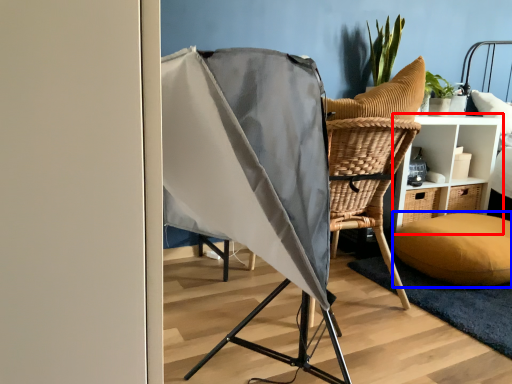
Question: Among these objects, which one is nearest to the camera, furniture (highlighted by a red box) or pillow (highlighted by a blue box)?

Choices:
 (A) furniture
 (B) pillow

Answer: (B)